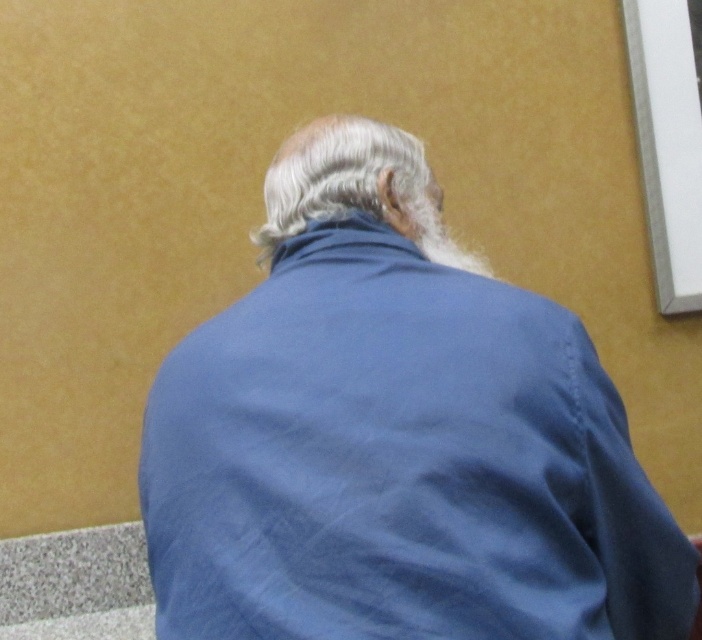
Can you confirm if blue fabric jacket at center is positioned below white matte hair at center?

Correct, blue fabric jacket at center is located below white matte hair at center.

Between point (423, 634) and point (345, 122), which one is positioned in front?

Point (423, 634) is more forward.

This screenshot has width=702, height=640. Find the location of `blue fabric jacket at center`. blue fabric jacket at center is located at coordinates (395, 436).